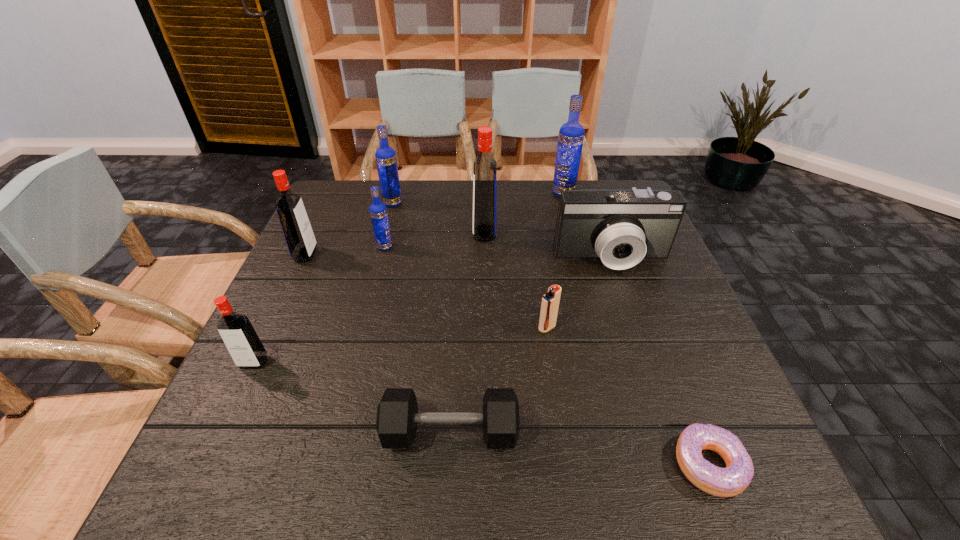
Image resolution: width=960 pixels, height=540 pixels. What are the coordinates of `free space located 0.120m on the front and back of the second farthest red vodka` in the screenshot? It's located at (361, 254).

The width and height of the screenshot is (960, 540). Identify the location of blank area located on the lens of the black camcorder. (653, 376).

Find the location of `vacant space positioned on the right of the smallest blue vodka`. vacant space positioned on the right of the smallest blue vodka is located at coordinates (513, 247).

This screenshot has height=540, width=960. Find the location of `vacant area situated on the front and back of the nearest vodka`. vacant area situated on the front and back of the nearest vodka is located at coordinates (217, 441).

Find the location of a particular element. This screenshot has height=540, width=960. free space located 0.070m on the right of the seventh farthest object is located at coordinates (588, 328).

This screenshot has width=960, height=540. What are the coordinates of `vacant space located 0.390m on the back of the second shortest object` in the screenshot? It's located at (459, 272).

The width and height of the screenshot is (960, 540). I want to click on vacant region located on the back of the doughnut, so click(x=654, y=323).

Locate an element on the screen. The image size is (960, 540). dumbbell located in the near edge section of the desktop is located at coordinates (397, 413).

Locate an element on the screen. The height and width of the screenshot is (540, 960). doughnut that is at the near edge is located at coordinates (723, 482).

Identify the location of camcorder that is positioned at the right edge. This screenshot has height=540, width=960. (621, 227).